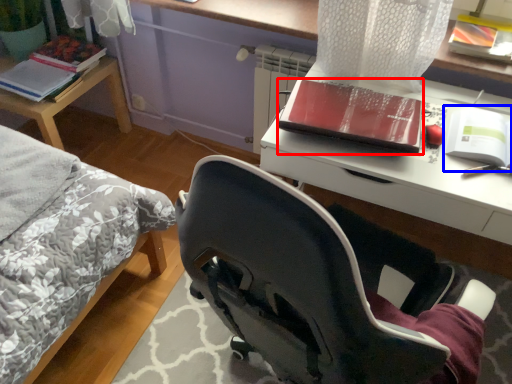
Question: Among these objects, which one is nearest to the camera, book (highlighted by a red box) or paperback book (highlighted by a blue box)?

Choices:
 (A) book
 (B) paperback book

Answer: (B)